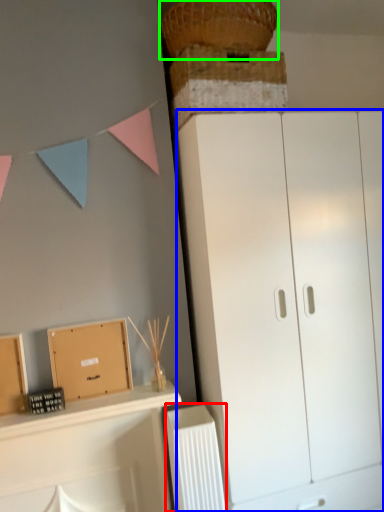
Question: Considering the real-world distances, which object is farthest from radiator (highlighted by a red box)? cupboard (highlighted by a blue box) or basket (highlighted by a green box)?

Choices:
 (A) cupboard
 (B) basket

Answer: (B)